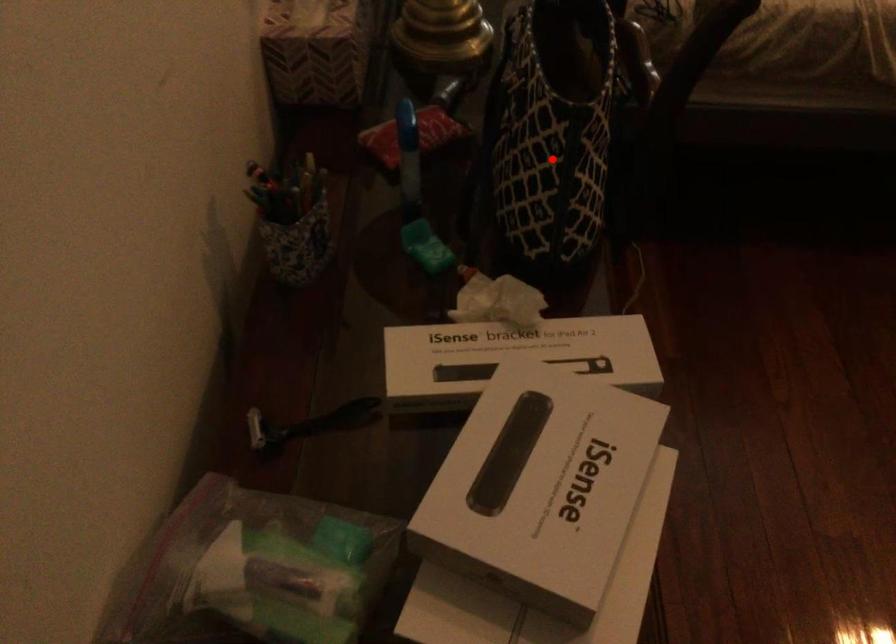
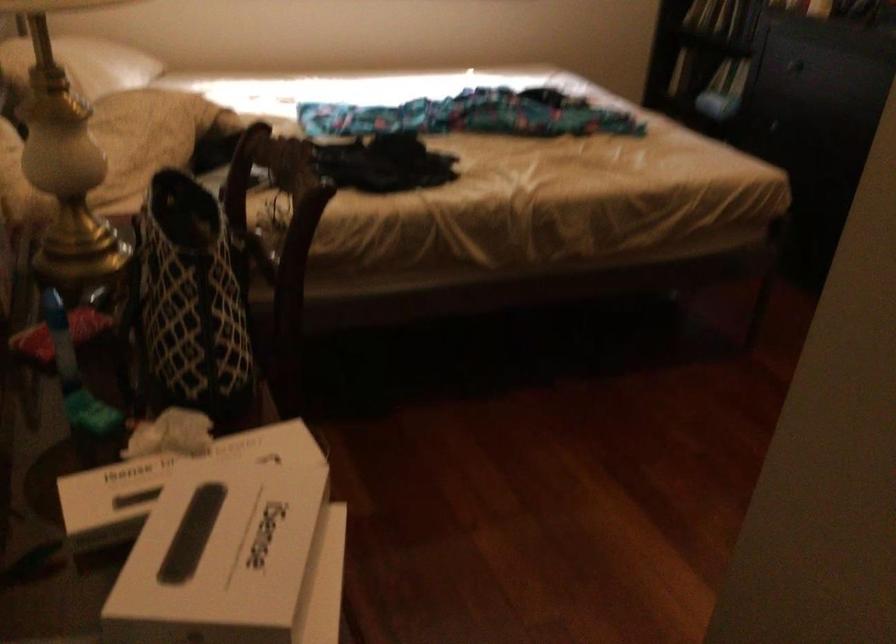
Question: I am providing you with two images of the same scene from different viewpoints. In image1, a red point is highlighted. Considering the same 3D point in image2, which of the following is correct?

Choices:
 (A) It is closer
 (B) It is farther

Answer: (B)